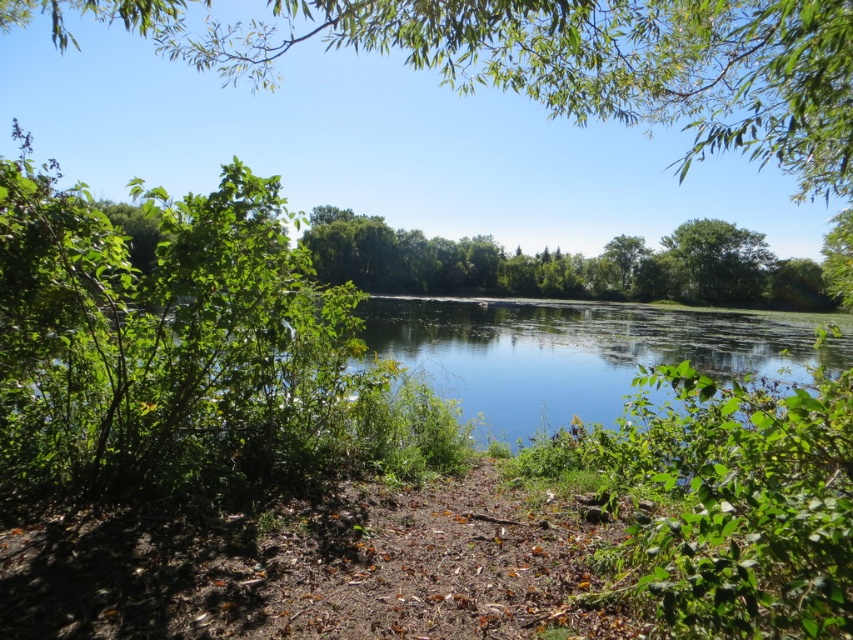
Question: Can you confirm if green leafy tree at upper right is wider than green leafy tree at upper center?

Choices:
 (A) no
 (B) yes

Answer: (B)

Question: Is clear blue water at center in front of green leafy tree at upper center?

Choices:
 (A) yes
 (B) no

Answer: (A)

Question: Does green leafy tree at upper right have a smaller size compared to green leafy tree at upper center?

Choices:
 (A) no
 (B) yes

Answer: (A)

Question: Which of these objects is positioned closest to the green leafy tree at upper center?

Choices:
 (A) clear blue water at center
 (B) green leafy tree at upper right

Answer: (B)

Question: Which point is closer to the camera?

Choices:
 (A) (643, 310)
 (B) (761, 248)

Answer: (A)

Question: Which of the following is the closest to the observer?

Choices:
 (A) (610, 248)
 (B) (689, 225)
 (C) (505, 316)

Answer: (C)